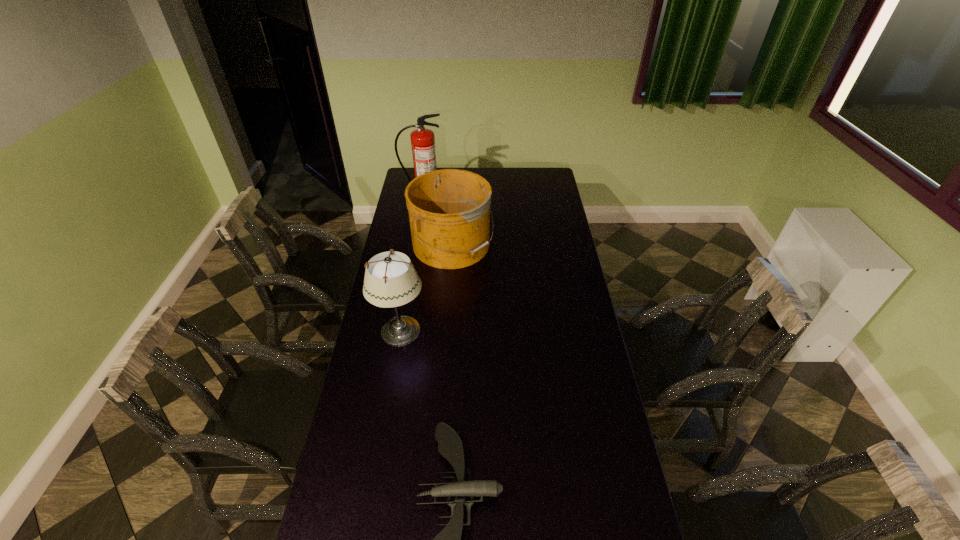
Image resolution: width=960 pixels, height=540 pixels. Find the location of `the farthest object`. the farthest object is located at coordinates (422, 140).

What are the coordinates of `the tallest object` in the screenshot? It's located at (422, 140).

Find the location of a particular element. This screenshot has height=540, width=960. lampshade is located at coordinates (391, 280).

You are a GUI agent. You are given a task and a screenshot of the screen. Output one action in this format:
    pyautogui.click(x=<x>, y=<y>)
    Task: Click on the third farthest object
    
    Given the screenshot: What is the action you would take?
    pyautogui.click(x=391, y=280)

This screenshot has height=540, width=960. Identify the location of bucket. (449, 210).

The height and width of the screenshot is (540, 960). Identify the location of the second shortest object. (449, 210).

Where is `vacant area located on the front-facing side of the fire extinguisher`? vacant area located on the front-facing side of the fire extinguisher is located at coordinates (415, 237).

You are a GUI agent. You are given a task and a screenshot of the screen. Output one action in this format:
    pyautogui.click(x=<x>, y=<y>)
    Task: Click on the free space located 0.070m on the lampshade of the second nearest object
    The width and height of the screenshot is (960, 540).
    Given the screenshot: What is the action you would take?
    pyautogui.click(x=444, y=332)

This screenshot has height=540, width=960. What are the coordinates of `vacant area located 0.220m on the front of the third tallest object` in the screenshot? It's located at (447, 307).

Find the location of a particular element. object located at the far edge is located at coordinates (422, 140).